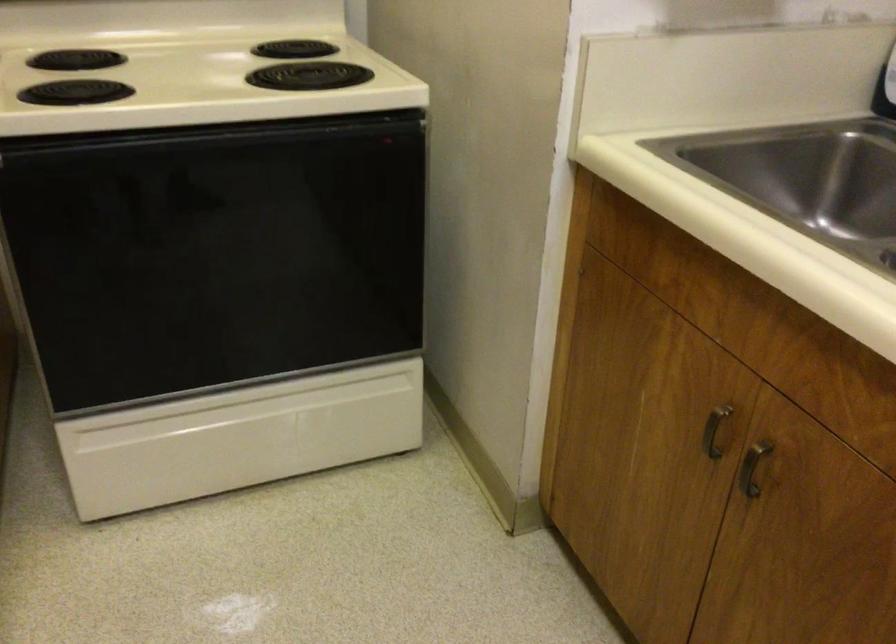
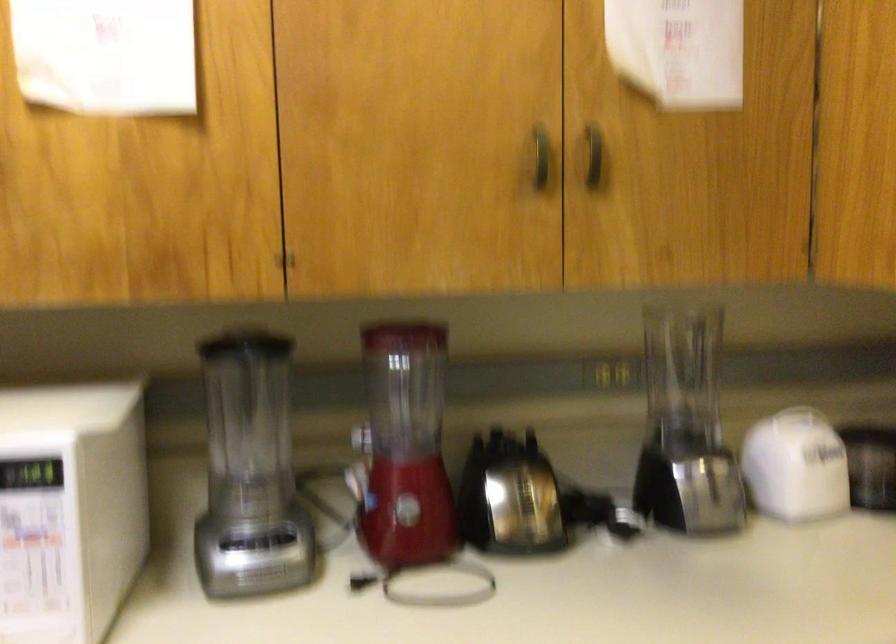
Question: The camera is either moving clockwise (left) or counter-clockwise (right) around the object. The first image is from the beginning of the video and the second image is from the end. Is the camera moving left or right when shooting the video?

Choices:
 (A) Left
 (B) Right

Answer: (B)